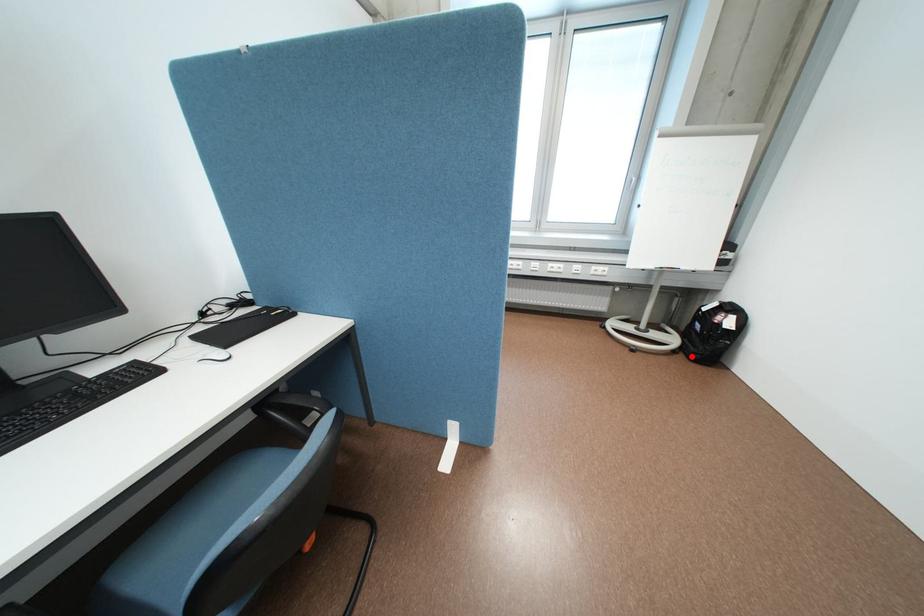
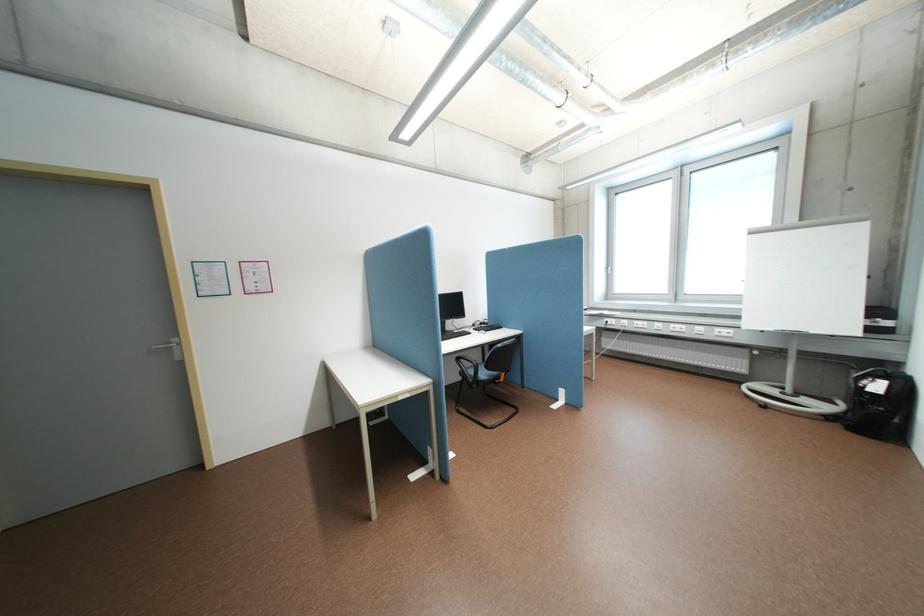
Where in the second image is the point corresponding to the highlighted location from the first image?

(848, 424)